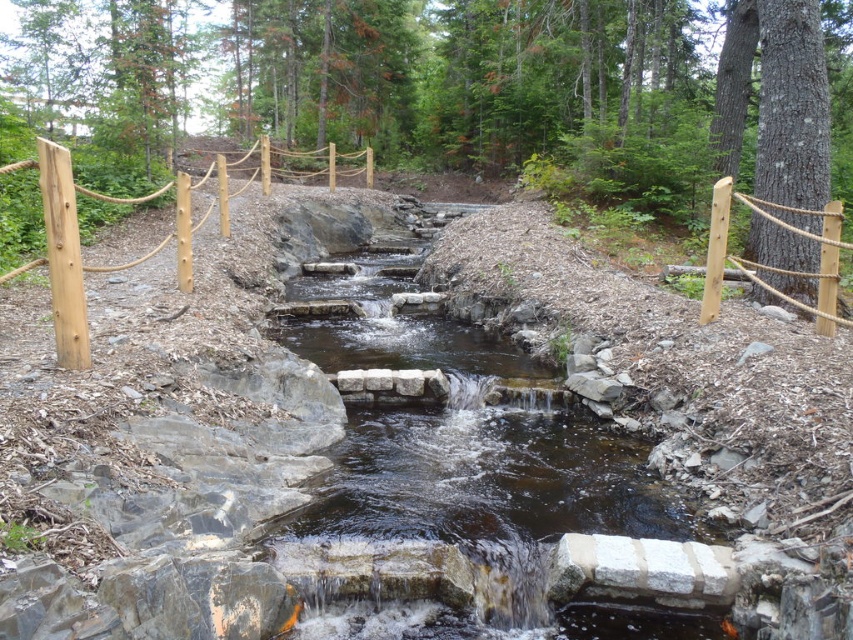
Can you confirm if smooth stone stream at center is wider than wooden post at left?

In fact, smooth stone stream at center might be narrower than wooden post at left.

Does smooth stone stream at center have a larger size compared to wooden post at left?

Actually, smooth stone stream at center might be smaller than wooden post at left.

Who is more distant from viewer, (294, 636) or (228, 164)?

Positioned behind is point (228, 164).

You are a GUI agent. You are given a task and a screenshot of the screen. Output one action in this format:
    pyautogui.click(x=<x>, y=<y>)
    Task: Click on the smooth stone stream at center
    
    Given the screenshot: What is the action you would take?
    pyautogui.click(x=469, y=476)

Is wooden post at left below brown wood post at right?

No.

Is wooden post at left taller than brown wood post at right?

Yes.

Does point (51, 241) come closer to viewer compared to point (833, 227)?

Yes, point (51, 241) is in front of point (833, 227).

The height and width of the screenshot is (640, 853). What are the coordinates of `wooden post at left` in the screenshot? It's located at (79, 250).

Is smooth stone stream at center bigger than brown wood post at right?

Incorrect, smooth stone stream at center is not larger than brown wood post at right.

Describe the element at coordinates (469, 476) in the screenshot. I see `smooth stone stream at center` at that location.

What do you see at coordinates (469, 476) in the screenshot?
I see `smooth stone stream at center` at bounding box center [469, 476].

Where is `smooth stone stream at center`? smooth stone stream at center is located at coordinates pyautogui.click(x=469, y=476).